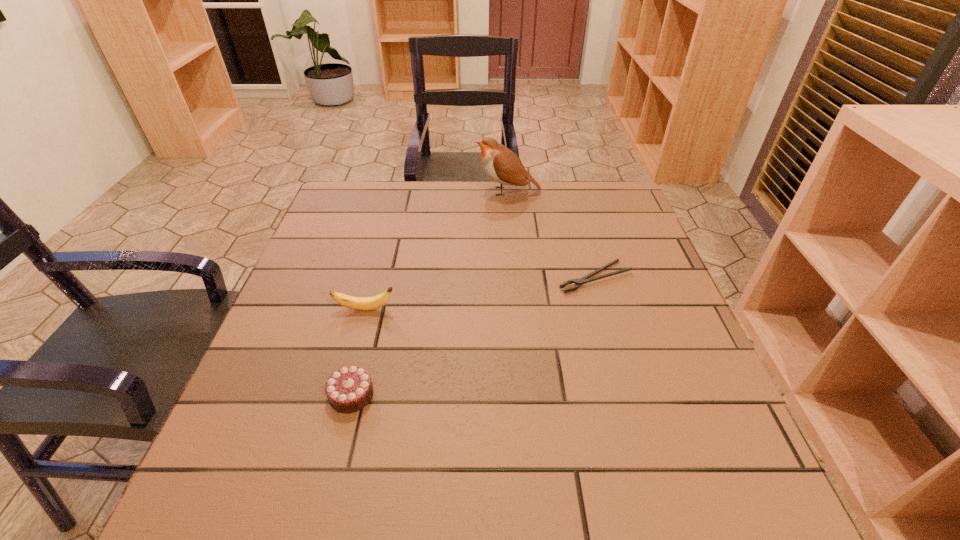
At what (x,y) coordinates should I click in order to perform the action: click on vacant space at the right edge. Please return your answer as a coordinate pair (x, y). Looking at the image, I should click on (701, 387).

In order to click on vacant space at the far right corner of the desktop in this screenshot , I will do `click(600, 213)`.

The image size is (960, 540). Find the location of `vacant area that lies between the bird and the second shortest object`. vacant area that lies between the bird and the second shortest object is located at coordinates point(430,293).

At what (x,y) coordinates should I click in order to perform the action: click on free space that is in between the bird and the chocolate cake. Please return your answer as a coordinate pair (x, y). Looking at the image, I should click on (430, 293).

The height and width of the screenshot is (540, 960). Identify the location of free space that is in between the third farthest object and the nearest object. (359, 352).

The image size is (960, 540). What are the coordinates of `free space between the chocolate cake and the banana` in the screenshot? It's located at [359, 352].

The image size is (960, 540). Identify the location of empty location between the second shortest object and the banana. (359, 352).

This screenshot has height=540, width=960. In order to click on vacant space that is in between the third nearest object and the chocolate cake in this screenshot , I will do `click(473, 336)`.

Find the location of a particular element. The width and height of the screenshot is (960, 540). free space between the bird and the tongs is located at coordinates (551, 234).

Where is `unoccupied area between the tongs and the third tallest object`? unoccupied area between the tongs and the third tallest object is located at coordinates (473, 336).